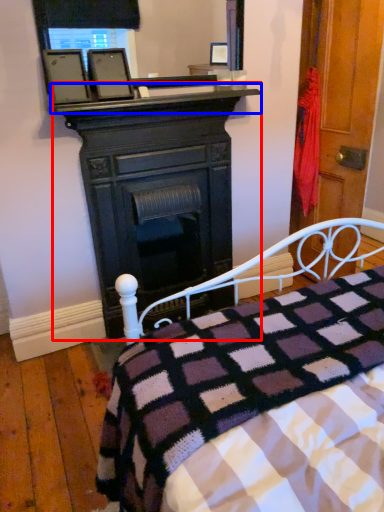
Question: Which point is closer to the camera, desk (highlighted by a red box) or mantle (highlighted by a blue box)?

Choices:
 (A) desk
 (B) mantle

Answer: (B)